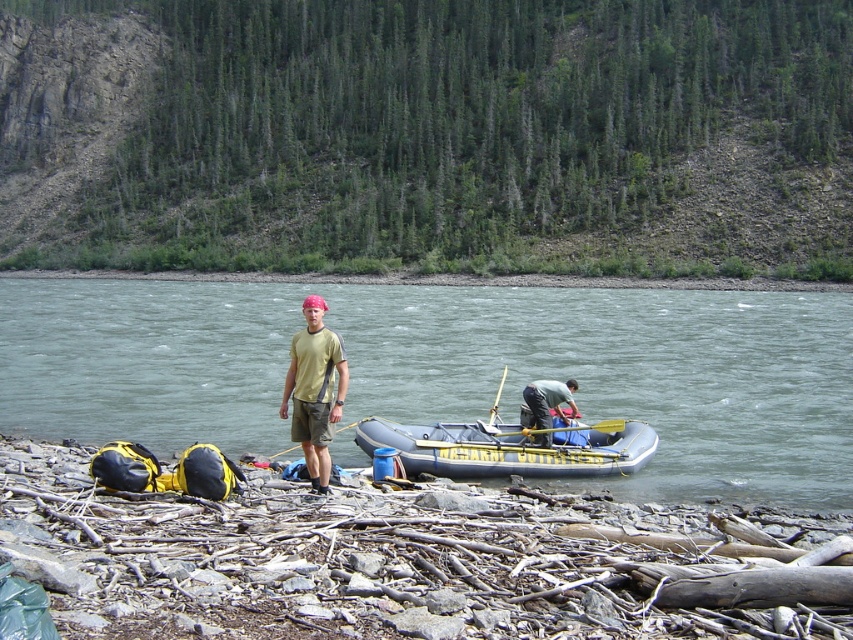
Question: Does gray rubber raft at lower center have a greater width compared to matte blue raft at center?

Choices:
 (A) yes
 (B) no

Answer: (A)

Question: Which point appears farthest from the camera in this image?

Choices:
 (A) (544, 412)
 (B) (552, 342)
 (C) (496, 448)
 (D) (303, 396)

Answer: (B)

Question: In this image, where is inflatable yellow at lower center located relative to matte yellow t-shirt at center?

Choices:
 (A) below
 (B) above

Answer: (A)

Question: Which point is farther from the camera taking this photo?

Choices:
 (A) (311, 346)
 (B) (618, 432)
 (C) (561, 413)

Answer: (B)

Question: Does gray rubber raft at lower center have a smaller size compared to inflatable yellow at lower center?

Choices:
 (A) no
 (B) yes

Answer: (A)

Question: Considering the real-world distances, which object is farthest from the matte blue raft at center?

Choices:
 (A) matte yellow t-shirt at center
 (B) inflatable yellow at lower center

Answer: (A)